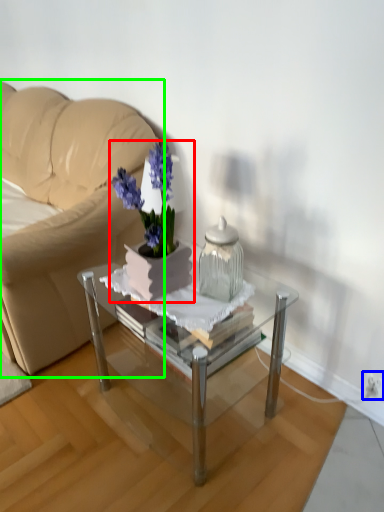
Question: Estimate the real-world distances between objects in this image. Which object is farther from houseplant (highlighted by a red box), electric outlet (highlighted by a blue box) or studio couch (highlighted by a green box)?

Choices:
 (A) electric outlet
 (B) studio couch

Answer: (A)